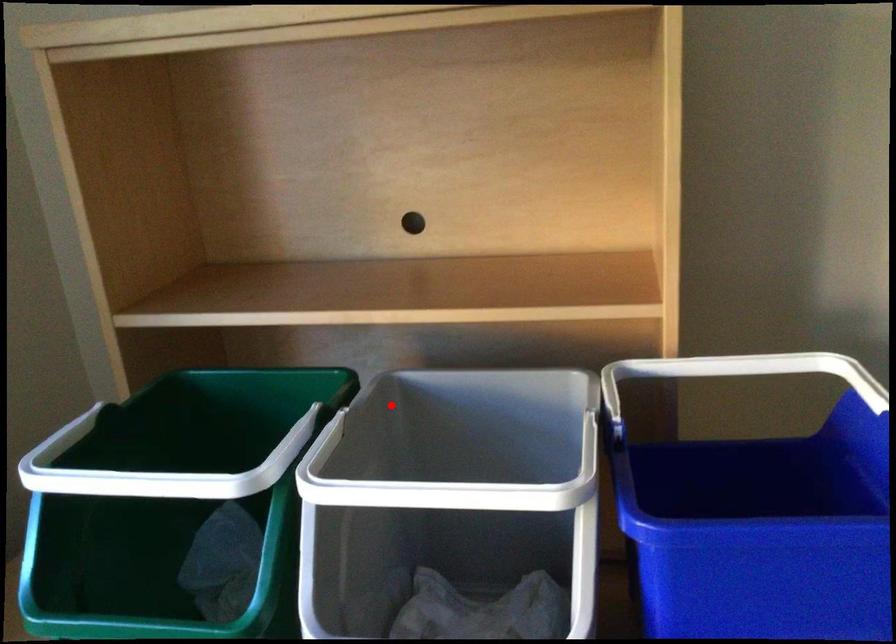
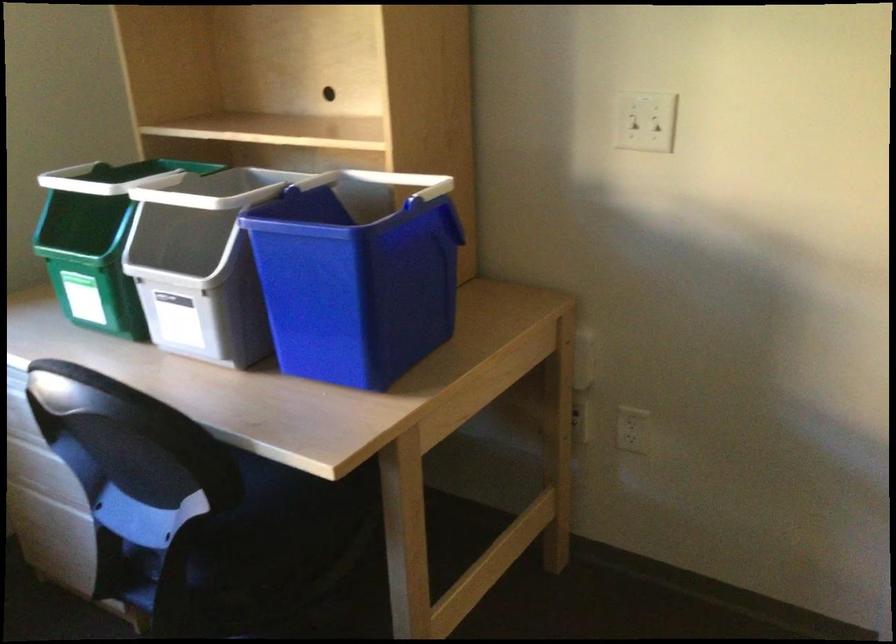
Question: I am providing you with two images of the same scene from different viewpoints. Image1 has a red point marked. In image2, the corresponding 3D location appears at what relative position? Reply with the corresponding letter.

Choices:
 (A) Closer
 (B) Farther

Answer: (B)